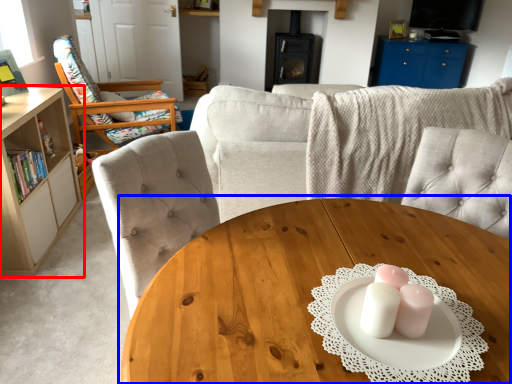
Question: Which object appears closest to the camera in this image, cabinetry (highlighted by a red box) or coffee table (highlighted by a blue box)?

Choices:
 (A) cabinetry
 (B) coffee table

Answer: (B)